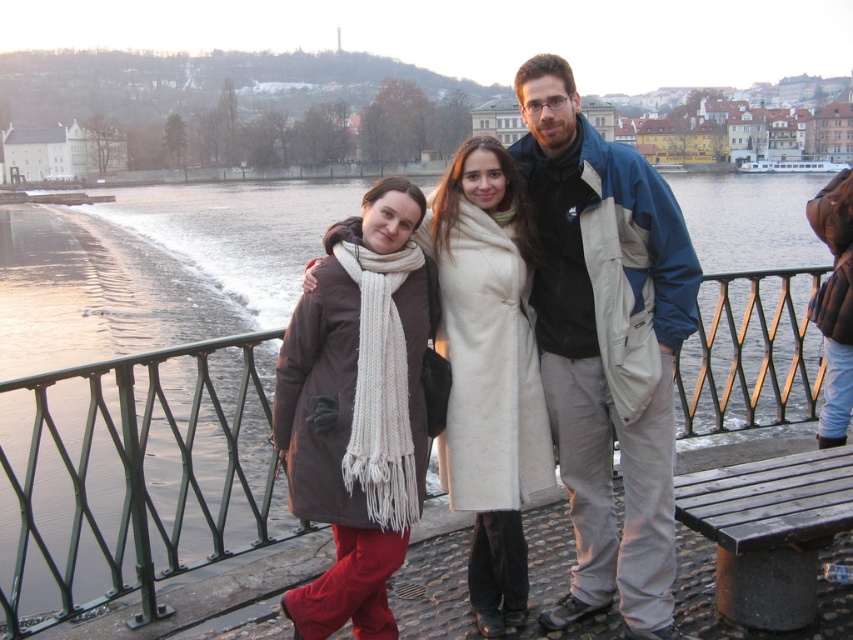
You are standing on the cobblestone walkway beside the river and want to reach the point marked at coordinates point (589, 202). If your walking speed is 3 feet per second, how many seconds will it take you to reach that point?

The point (589, 202) is 51.54 feet away from the viewer. At a speed of 3 feet per second, it would take approximately 17.18 seconds to reach it.